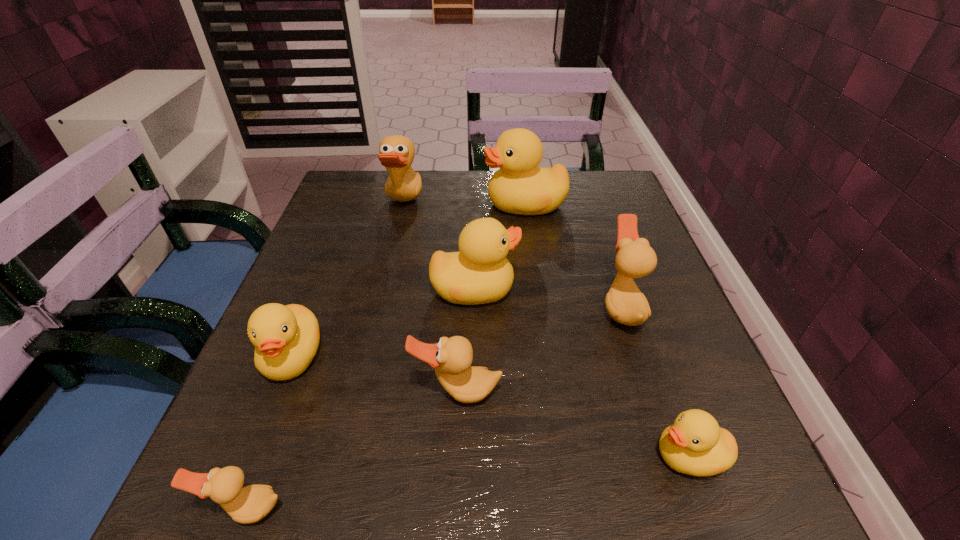
Locate an element on the screen. The image size is (960, 540). the biggest yellow duck is located at coordinates (520, 187).

Locate an element on the screen. The height and width of the screenshot is (540, 960). the biggest tan duck is located at coordinates (396, 153).

Image resolution: width=960 pixels, height=540 pixels. I want to click on the farthest tan duck, so click(x=396, y=153).

Locate an element on the screen. the second biggest yellow duck is located at coordinates (480, 273).

Where is `the second biggest tan duck`? Image resolution: width=960 pixels, height=540 pixels. the second biggest tan duck is located at coordinates (625, 303).

Image resolution: width=960 pixels, height=540 pixels. I want to click on the rightmost tan duck, so click(625, 303).

Locate an element on the screen. the leftmost yellow duck is located at coordinates (286, 338).

Find the location of a particular element. the third biggest yellow duck is located at coordinates (286, 338).

At what (x,y) coordinates should I click in order to perform the action: click on the second tan duck from right to left. Please return your answer as a coordinate pair (x, y). Looking at the image, I should click on (451, 358).

At what (x,y) coordinates should I click in order to perform the action: click on the third biggest tan duck. Please return your answer as a coordinate pair (x, y). Looking at the image, I should click on (451, 358).